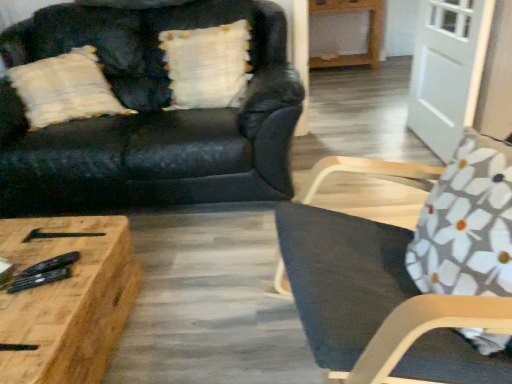
This screenshot has height=384, width=512. I want to click on vacant point above wooden coffee table at lower left (from a real-world perspective), so click(x=37, y=273).